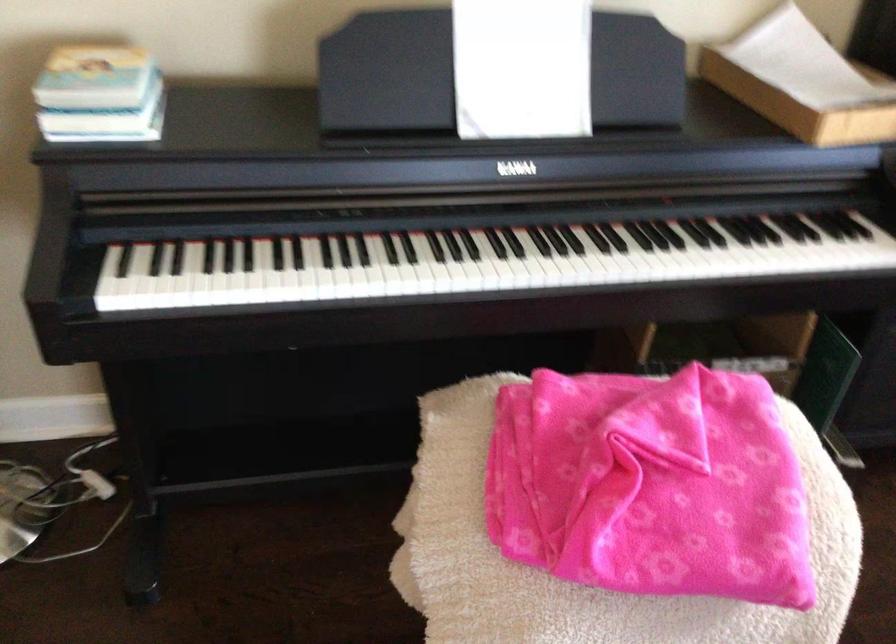
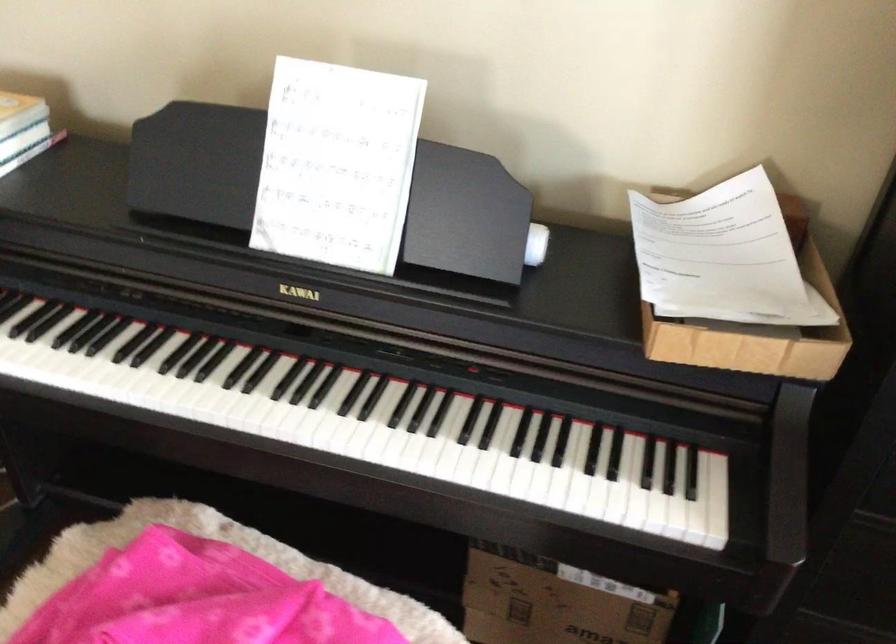
Locate, in the second image, the point that corresponds to point (539, 263) in the first image.

(245, 412)